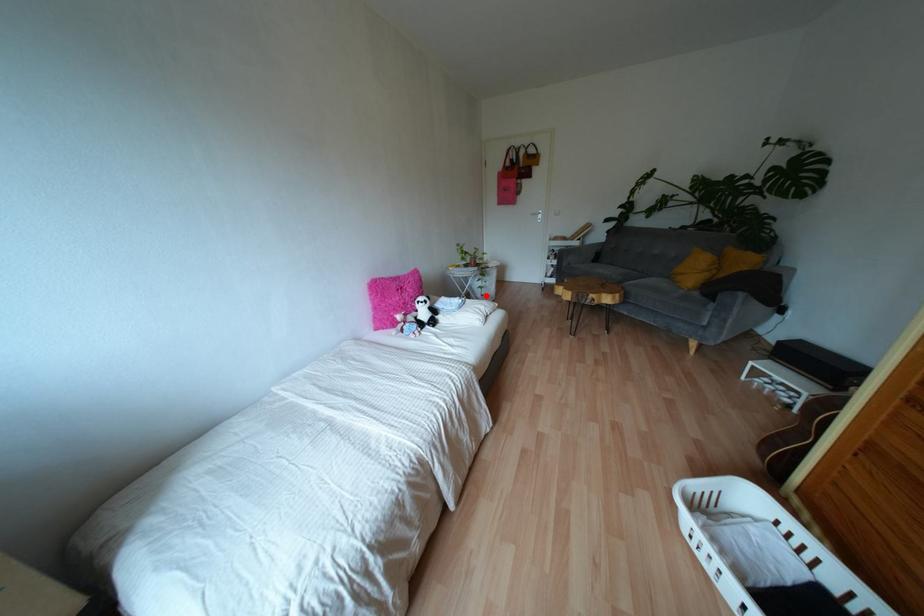
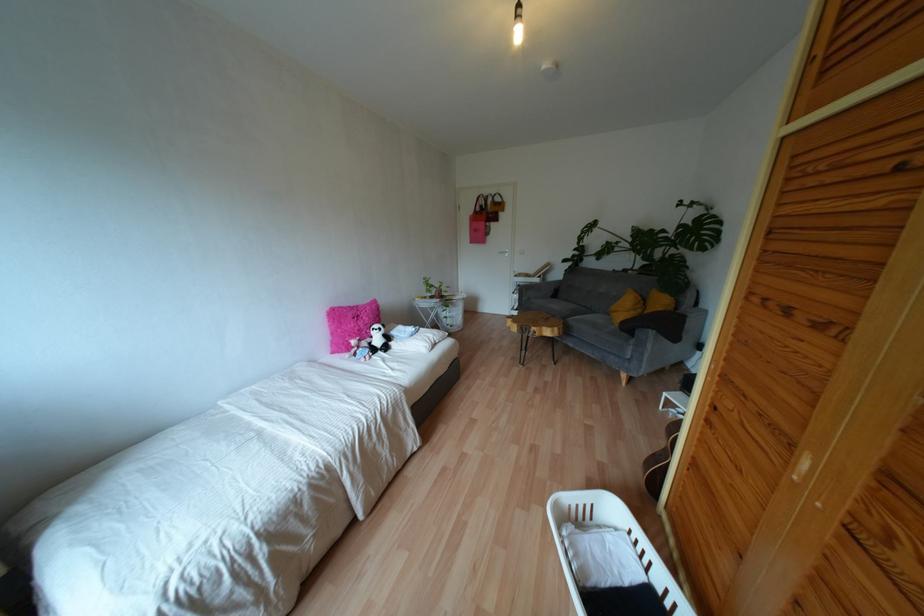
Question: I am providing you with two images of the same scene from different viewpoints. Image1 has a red point marked. In image2, the corresponding 3D location appears at what relative position? Reply with the corresponding letter.

Choices:
 (A) Closer
 (B) Farther

Answer: (A)